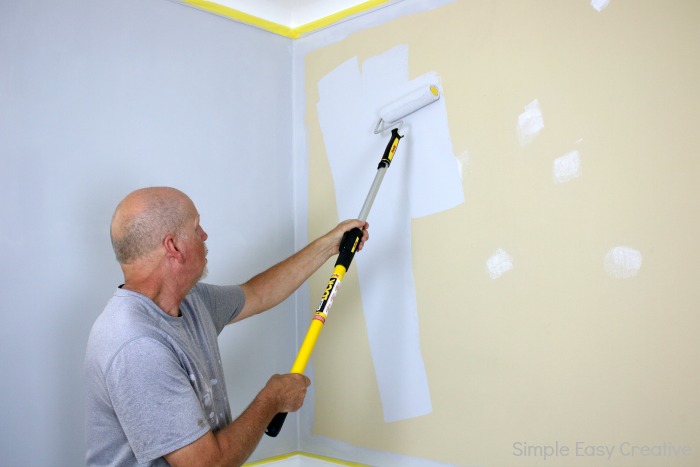
This screenshot has width=700, height=467. Find the location of `paint roller cover`. paint roller cover is located at coordinates (404, 102).